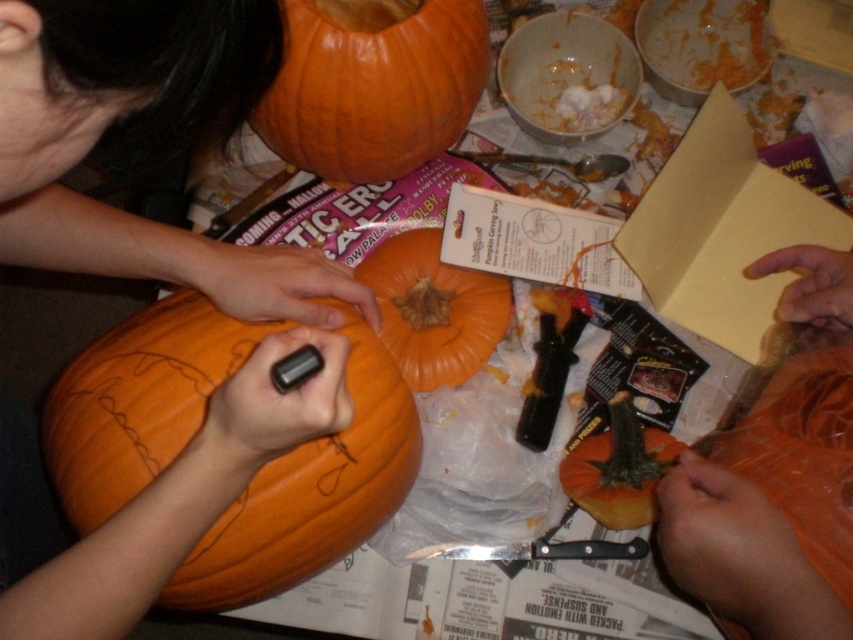
Question: Which point appears farthest from the camera in this image?

Choices:
 (A) (437, 115)
 (B) (645, 442)
 (C) (480, 333)

Answer: (A)

Question: Which object is farther from the camera taking this photo?

Choices:
 (A) orange matte pumpkin at center
 (B) orange matte pumpkin at upper center
 (C) smooth orange pumpkin at lower right

Answer: (A)

Question: Which point appears farthest from the camera in this image?

Choices:
 (A) (602, 472)
 (B) (202, 3)
 (C) (666, 502)

Answer: (A)

Question: Is orange matte pumpkin at upper center closer to camera compared to orange matte pumpkin at center?

Choices:
 (A) no
 (B) yes

Answer: (B)

Question: Is smooth orange pumpkin at center below orange matte pumpkin at lower right?

Choices:
 (A) no
 (B) yes

Answer: (A)

Question: Observing the image, what is the correct spatial positioning of orange matte pumpkin at upper center in reference to orange matte pumpkin at lower right?

Choices:
 (A) above
 (B) below

Answer: (A)